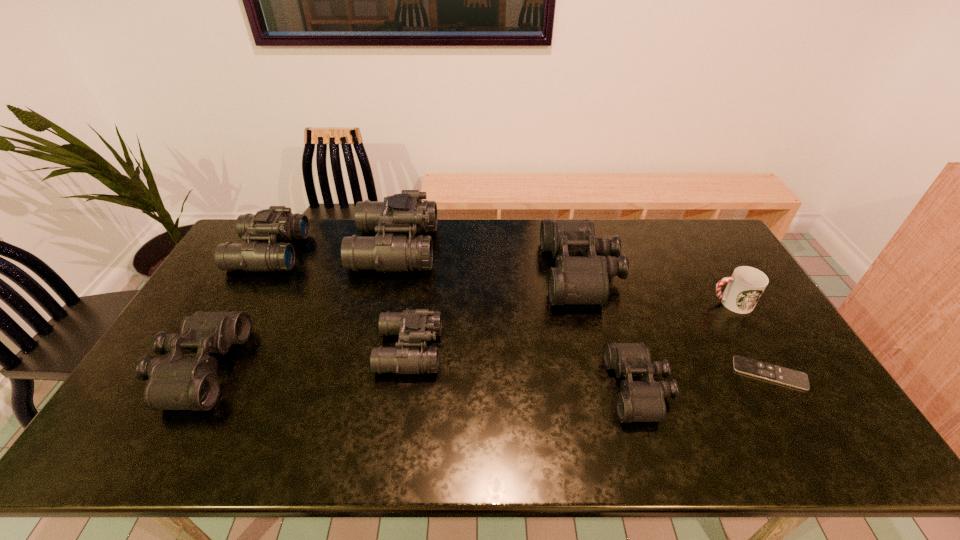
Where is `vacant region located 0.110m at the eyepieces of the shortest binoculars`? vacant region located 0.110m at the eyepieces of the shortest binoculars is located at coordinates (568, 388).

The width and height of the screenshot is (960, 540). I want to click on free spot located 0.250m at the eyepieces of the shortest binoculars, so click(x=514, y=388).

Where is `free location located 0.310m at the eyepieces of the shortest binoculars`? This screenshot has width=960, height=540. free location located 0.310m at the eyepieces of the shortest binoculars is located at coordinates (491, 388).

Where is `free region located 0.090m on the back of the remote control`? This screenshot has height=540, width=960. free region located 0.090m on the back of the remote control is located at coordinates point(745,332).

Where is `object that is positioned at the near edge`? object that is positioned at the near edge is located at coordinates (639, 401).

Find the location of a particular element. The image size is (960, 540). cup at the right edge is located at coordinates coord(746,285).

Where is `remote control that is at the right edge`? Image resolution: width=960 pixels, height=540 pixels. remote control that is at the right edge is located at coordinates (755, 368).

You are a GUI agent. You are given a task and a screenshot of the screen. Output one action in this format:
    pyautogui.click(x=<x>, y=<y>)
    Task: Click on the object situated at the far left corner
    This screenshot has height=540, width=960.
    Given the screenshot: What is the action you would take?
    pyautogui.click(x=276, y=223)

This screenshot has height=540, width=960. I want to click on vacant region at the far edge of the desktop, so click(525, 240).

I want to click on vacant space at the near edge of the desktop, so click(x=289, y=436).